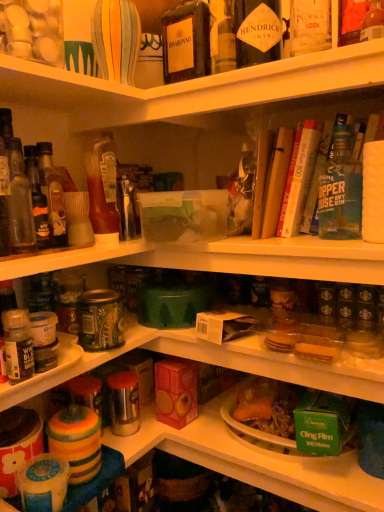
Question: Is hardcover book at upper right, arranged as the 2th book when viewed from the left, smaller than translucent glass bottle at upper left, the fifth bottle positioned from the left?

Choices:
 (A) yes
 (B) no

Answer: (B)

Question: Considering the relative sizes of hardcover book at upper right, arranged as the 2th book when viewed from the left, and translucent glass bottle at upper left, the 3th bottle in the right-to-left sequence, in the image provided, is hardcover book at upper right, arranged as the 2th book when viewed from the left, shorter than translucent glass bottle at upper left, the 3th bottle in the right-to-left sequence,?

Choices:
 (A) yes
 (B) no

Answer: (B)

Question: Is hardcover book at upper right, the 2th book in the right-to-left sequence, far away from translucent glass bottle at upper left, the fifth bottle positioned from the left?

Choices:
 (A) no
 (B) yes

Answer: (A)

Question: Does hardcover book at upper right, arranged as the 2th book when viewed from the left, come behind translucent glass bottle at upper left, the 3th bottle in the right-to-left sequence?

Choices:
 (A) yes
 (B) no

Answer: (A)

Question: Considering the relative sizes of hardcover book at upper right, the 2th book in the right-to-left sequence, and translucent glass bottle at upper left, the 3th bottle in the right-to-left sequence, in the image provided, is hardcover book at upper right, the 2th book in the right-to-left sequence, taller than translucent glass bottle at upper left, the 3th bottle in the right-to-left sequence,?

Choices:
 (A) yes
 (B) no

Answer: (A)

Question: From the image's perspective, relative to translucent glass bottle at left, the 1th bottle in the left-to-right sequence, is hardcover book at upper right, the 2th book in the right-to-left sequence, above or below?

Choices:
 (A) above
 (B) below

Answer: (A)

Question: Considering their positions, is hardcover book at upper right, arranged as the 2th book when viewed from the left, located in front of or behind translucent glass bottle at left, the 7th bottle from the right?

Choices:
 (A) behind
 (B) front

Answer: (A)

Question: Does point (304, 120) appear closer or farther from the camera than point (21, 175)?

Choices:
 (A) closer
 (B) farther

Answer: (B)

Question: Considering the positions of hardcover book at upper right, the 2th book in the right-to-left sequence, and translucent glass bottle at left, the 1th bottle in the left-to-right sequence, in the image, is hardcover book at upper right, the 2th book in the right-to-left sequence, wider or thinner than translucent glass bottle at left, the 1th bottle in the left-to-right sequence,?

Choices:
 (A) thin
 (B) wide

Answer: (B)

Question: Would you say translucent glass bottle at upper left, the 3th bottle in the right-to-left sequence, is inside or outside matte glass bottle at left, acting as the 6th bottle starting from the right?

Choices:
 (A) inside
 (B) outside

Answer: (B)

Question: Considering their positions, is translucent glass bottle at upper left, the fifth bottle positioned from the left, located in front of or behind matte glass bottle at left, acting as the 6th bottle starting from the right?

Choices:
 (A) front
 (B) behind

Answer: (B)

Question: Is translucent glass bottle at upper left, the 3th bottle in the right-to-left sequence, to the left or to the right of matte glass bottle at left, acting as the 6th bottle starting from the right, in the image?

Choices:
 (A) right
 (B) left

Answer: (A)

Question: Considering the positions of point (112, 232) and point (36, 211), is point (112, 232) closer or farther from the camera than point (36, 211)?

Choices:
 (A) farther
 (B) closer

Answer: (A)

Question: In terms of height, does translucent glass bottle at upper left, the fifth bottle positioned from the left, look taller or shorter compared to clear plastic container at upper center, marked as the second shelf in a left-to-right arrangement?

Choices:
 (A) tall
 (B) short

Answer: (A)

Question: Is translucent glass bottle at upper left, the 3th bottle in the right-to-left sequence, in front of or behind clear plastic container at upper center, marked as the second shelf in a left-to-right arrangement, in the image?

Choices:
 (A) behind
 (B) front

Answer: (A)